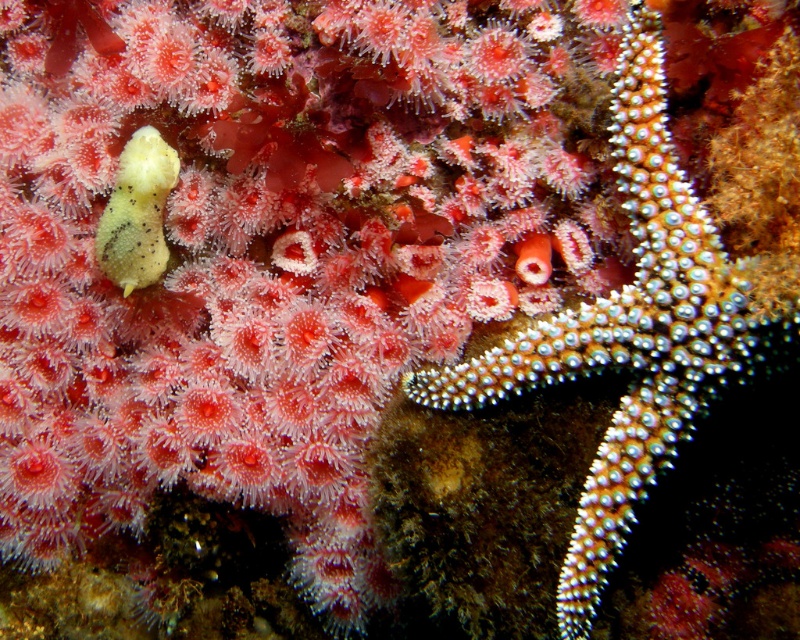
Does point (717, 296) come behind point (137, 253)?

No.

Is white spiny starfish at center positioned at the back of matte yellow sponge at left?

No.

Find the location of a particular element. white spiny starfish at center is located at coordinates (629, 332).

Find the location of a particular element. white spiny starfish at center is located at coordinates (629, 332).